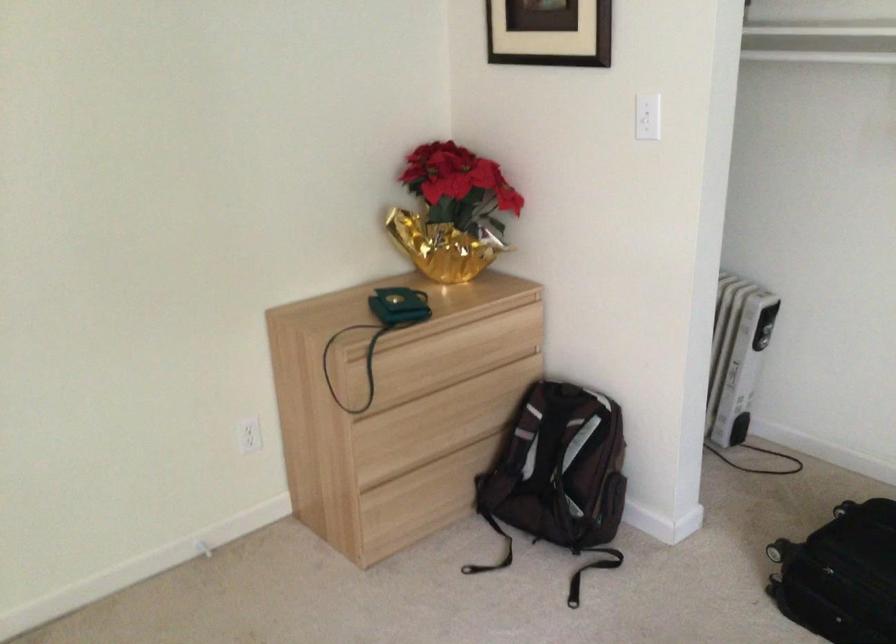
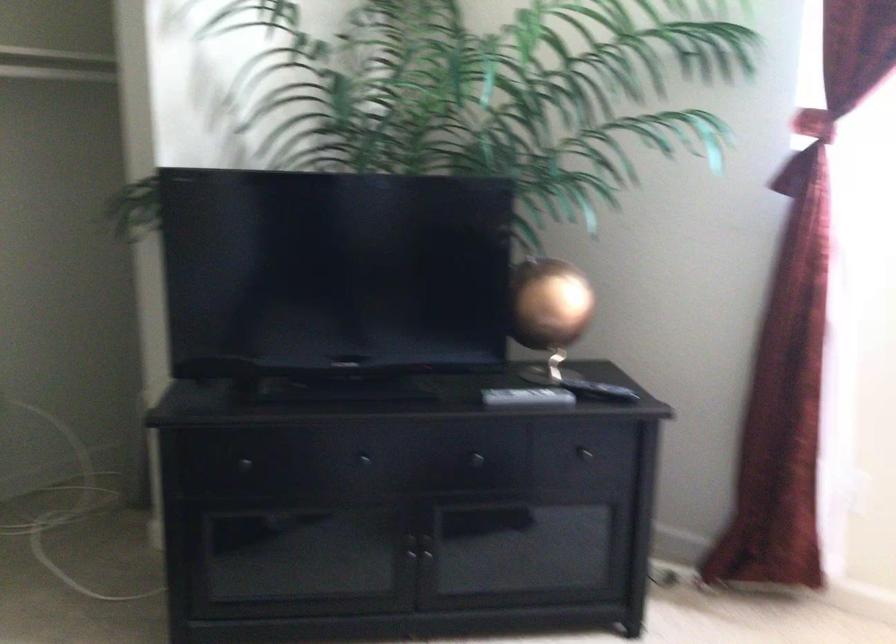
Question: The camera is either moving clockwise (left) or counter-clockwise (right) around the object. The first image is from the beginning of the video and the second image is from the end. Is the camera moving left or right when shooting the video?

Choices:
 (A) Left
 (B) Right

Answer: (A)